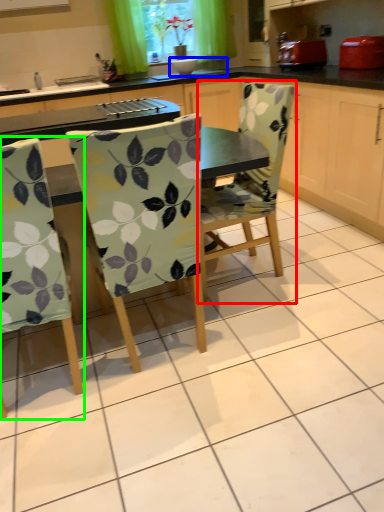
Question: Which object is positioned farthest from chair (highlighted by a red box)? Select from sink (highlighted by a blue box) and chair (highlighted by a green box).

Choices:
 (A) sink
 (B) chair

Answer: (A)